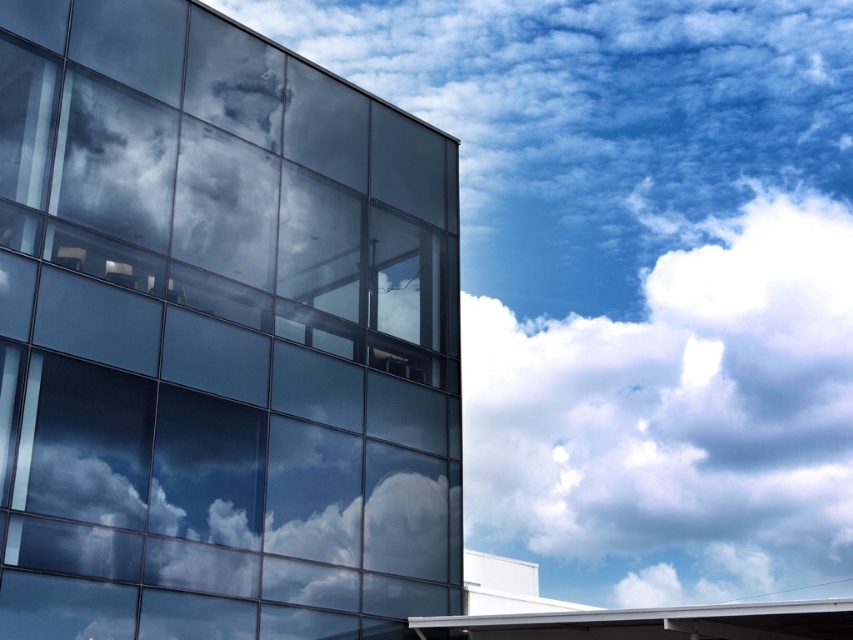
You are standing in front of the modern building and notice the transparent glass window at left and the white fluffy cloud at upper right. Which object is nearer to you?

The transparent glass window at left is closer to the viewer than the white fluffy cloud at upper right.

You are an architect reviewing a design plan. You notice the transparent glass window at left and the white fluffy cloud at upper right in the image. Which object is positioned to the left of the other?

The transparent glass window at left is positioned to the left of the white fluffy cloud at upper right.

You are an architect analyzing the building facade. You notice the transparent glass window at left and the white fluffy cloud at upper right. Which of these two elements takes up more area in the scene?

The white fluffy cloud at upper right takes up more area than the transparent glass window at left.